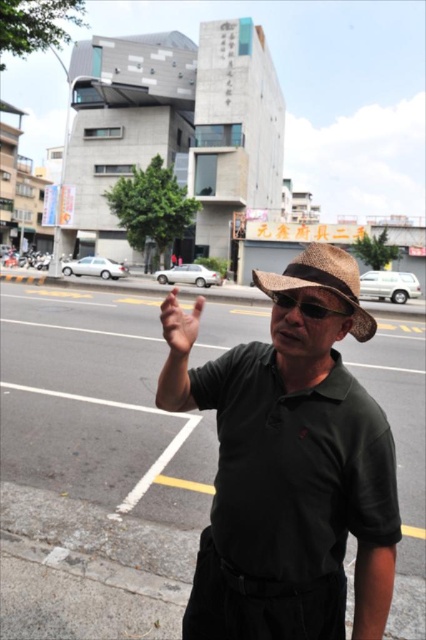
You are standing on the sidewalk and want to reach the entrance of the building. The entrance is located at point (371, 317). You have a 1.2 meter long stick. Can you use the stick to touch the entrance from where you are standing?

The distance of point (371, 317) from the camera is 1.17 meters. Since the stick is 1.2 meters long, you can extend the stick to reach the entrance at point (371, 317) as the stick is slightly longer than the distance required.

You are a fashion designer observing a man on the street wearing a dark green polo shirt at center and a woven straw hat at center. Which clothing item is located higher on his body?

The woven straw hat at center is higher on the man because it is positioned above the dark green polo shirt at center.

You are a fashion designer observing a man on a busy street. You notice the dark green polo shirt at center and the black plastic goggles at center. Which clothing item is positioned to the right?

The black plastic goggles at center are positioned to the right of the dark green polo shirt at center.